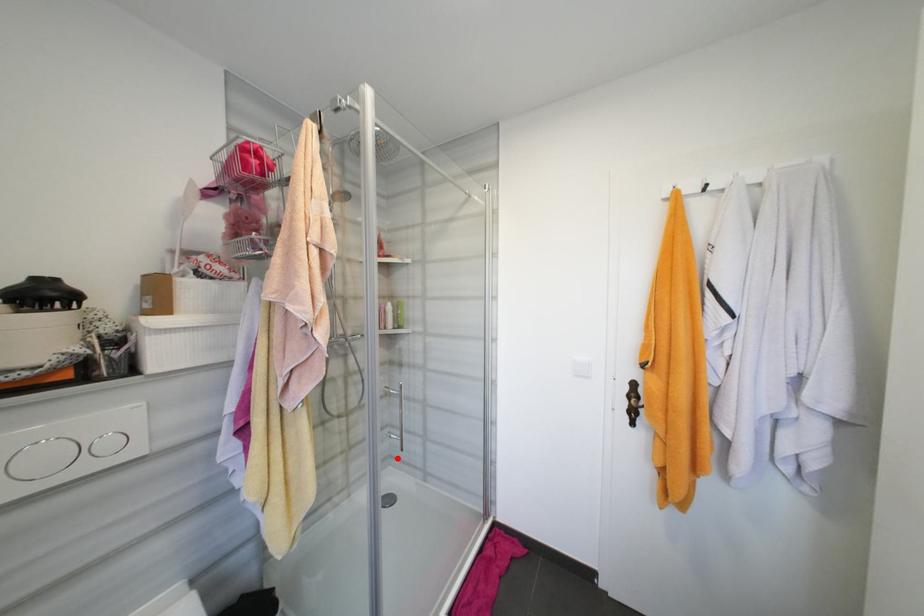
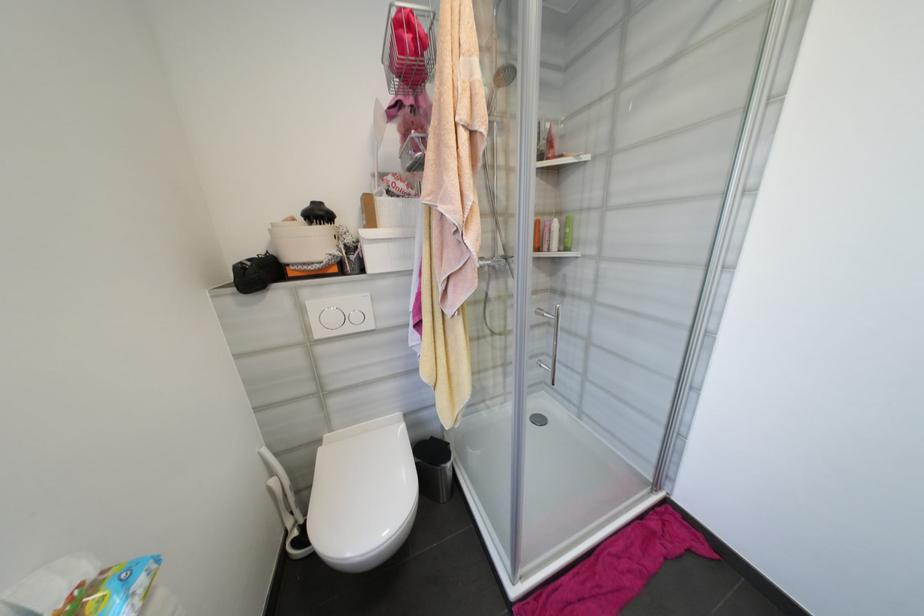
Where in the second image is the point corresponding to the highlighted location from the first image?

(552, 384)